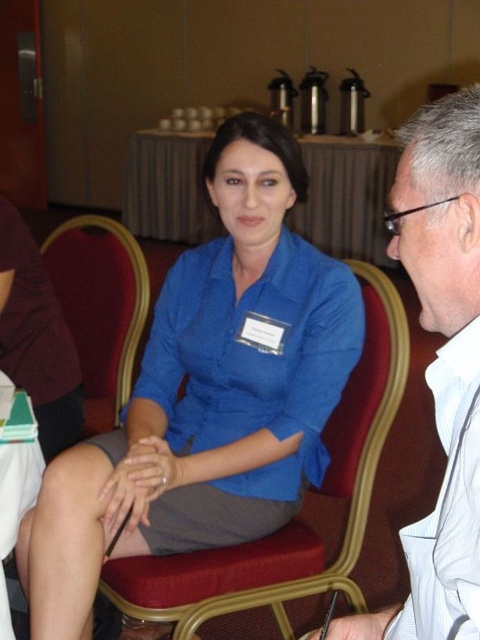
From the picture: Is white cotton shirt at right behind velvet upholstered chair at center?

No.

You are a GUI agent. You are given a task and a screenshot of the screen. Output one action in this format:
    pyautogui.click(x=<x>, y=<y>)
    Task: Click on the white cotton shirt at right
    
    Given the screenshot: What is the action you would take?
    pyautogui.click(x=447, y=506)

Can you confirm if blue fabric shirt at center is positioned to the right of white cotton shirt at right?

Incorrect, blue fabric shirt at center is not on the right side of white cotton shirt at right.

This screenshot has width=480, height=640. What do you see at coordinates (207, 392) in the screenshot?
I see `blue fabric shirt at center` at bounding box center [207, 392].

The width and height of the screenshot is (480, 640). In order to click on blue fabric shirt at center in this screenshot , I will do pyautogui.click(x=207, y=392).

At what (x,y) coordinates should I click in order to perform the action: click on white glossy shirt at right. Please return your answer as a coordinate pair (x, y). The width and height of the screenshot is (480, 640). Looking at the image, I should click on (441, 368).

Which of these two, white glossy shirt at right or white cotton shirt at right, stands shorter?

white cotton shirt at right

Image resolution: width=480 pixels, height=640 pixels. Find the location of `white glossy shirt at right`. white glossy shirt at right is located at coordinates (441, 368).

In order to click on white glossy shirt at right in this screenshot , I will do `click(441, 368)`.